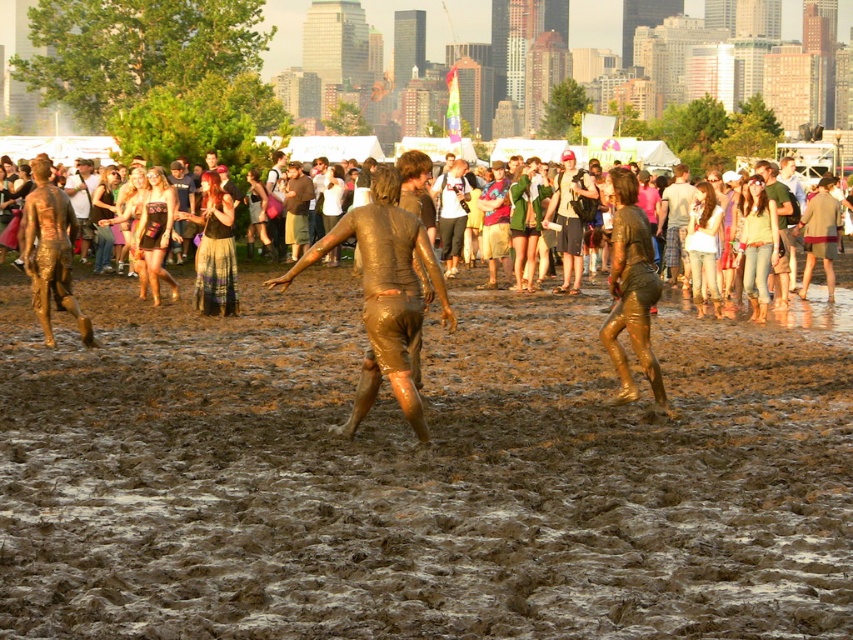
Does muddy skin at center have a larger size compared to gold shiny mud at center?

Yes.

Can you confirm if muddy skin at center is taller than gold shiny mud at center?

Yes.

I want to click on muddy skin at center, so click(386, 296).

You are a GUI agent. You are given a task and a screenshot of the screen. Output one action in this format:
    pyautogui.click(x=<x>, y=<y>)
    Task: Click on the muddy skin at center
    This screenshot has height=640, width=853.
    Given the screenshot: What is the action you would take?
    pyautogui.click(x=386, y=296)

Does muddy skin at center have a greater width compared to brown leather jacket at center?

Yes, muddy skin at center is wider than brown leather jacket at center.

Is muddy skin at center to the left of brown leather jacket at center from the viewer's perspective?

Incorrect, muddy skin at center is not on the left side of brown leather jacket at center.

Is point (416, 426) more distant than point (181, 236)?

No, it is in front of (181, 236).

This screenshot has height=640, width=853. Identify the location of muddy skin at center. (386, 296).

Is the position of gold shiny mud at center more distant than that of matte black dress at center?

No, it is not.

Which is in front, point (619, 371) or point (231, 272)?

Point (619, 371)

You are a GUI agent. You are given a task and a screenshot of the screen. Output one action in this format:
    pyautogui.click(x=<x>, y=<y>)
    Task: Click on the gold shiny mud at center
    Image resolution: width=853 pixels, height=640 pixels.
    Given the screenshot: What is the action you would take?
    pyautogui.click(x=631, y=291)